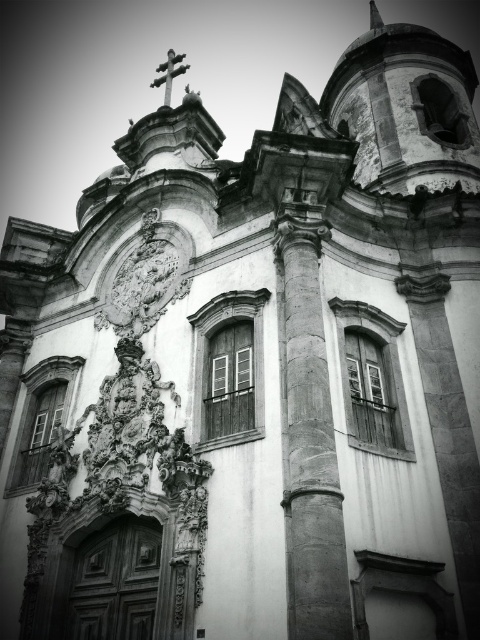
Describe the element at coordinates (310, 436) in the screenshot. Image resolution: width=480 pixels, height=640 pixels. I see `smooth stone column at center` at that location.

Is smooth stone column at center to the left of metallic cross at upper center from the viewer's perspective?

In fact, smooth stone column at center is to the right of metallic cross at upper center.

Locate an element on the screen. The image size is (480, 640). smooth stone column at center is located at coordinates (310, 436).

Which is behind, point (170, 60) or point (48, 490)?

The point (170, 60) is more distant.

Is metallic cross at upper center behind matte white clock at center?

Yes, metallic cross at upper center is behind matte white clock at center.

Is point (173, 58) in front of point (56, 490)?

No.

Image resolution: width=480 pixels, height=640 pixels. Find the location of `metallic cross at upper center`. metallic cross at upper center is located at coordinates (168, 74).

Measure the distance from smooth stone column at center to matte white clock at center.

The distance of smooth stone column at center from matte white clock at center is 25.62 meters.

This screenshot has width=480, height=640. What do you see at coordinates (310, 436) in the screenshot?
I see `smooth stone column at center` at bounding box center [310, 436].

This screenshot has width=480, height=640. What are the coordinates of `smooth stone column at center` in the screenshot? It's located at (310, 436).